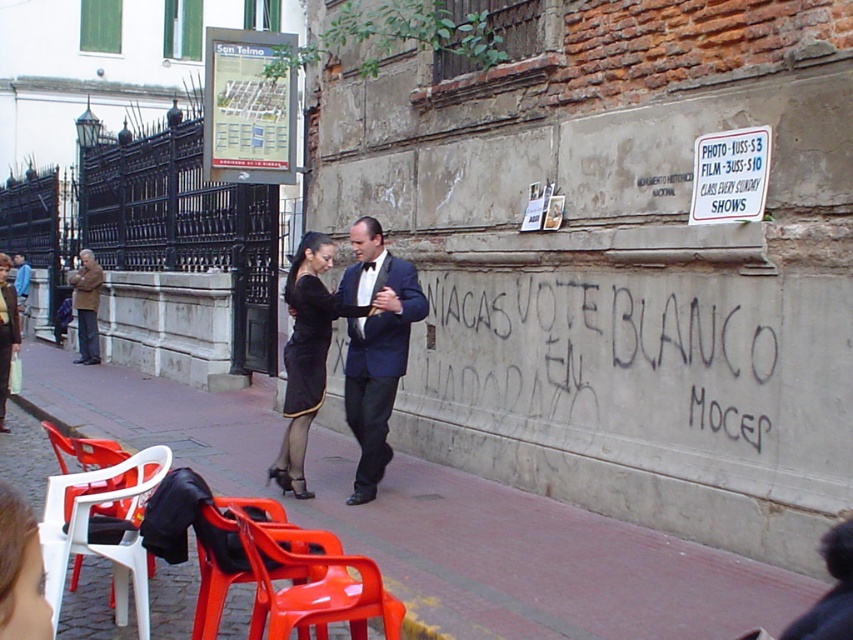
You are a photographer at the event and need to capture the dancers. The black satin dress at center and the matte black dress at center are both in your view. Which dress should you focus on if you want to highlight a smaller silhouette?

The black satin dress at center has a smaller size compared to the matte black dress at center, so focusing on the black satin dress at center would highlight the smaller silhouette.

You are a photographer positioned to capture the dancers. You notice the black satin dress at center and the white paper sign at upper right. Which object is closer to the camera?

The black satin dress at center is closer to the camera because the white paper sign at upper right is behind it.

You are a photographer trying to capture the dancers in the center of the image. You notice the black satin dress at center and the white paper sign at upper right. Which object is wider?

The black satin dress at center is wider than the white paper sign at upper right.